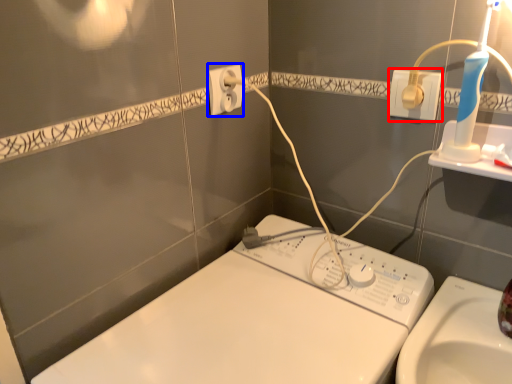
Question: Which of the following is the farthest to the observer, power plugs and sockets (highlighted by a red box) or power plugs and sockets (highlighted by a blue box)?

Choices:
 (A) power plugs and sockets
 (B) power plugs and sockets

Answer: (B)